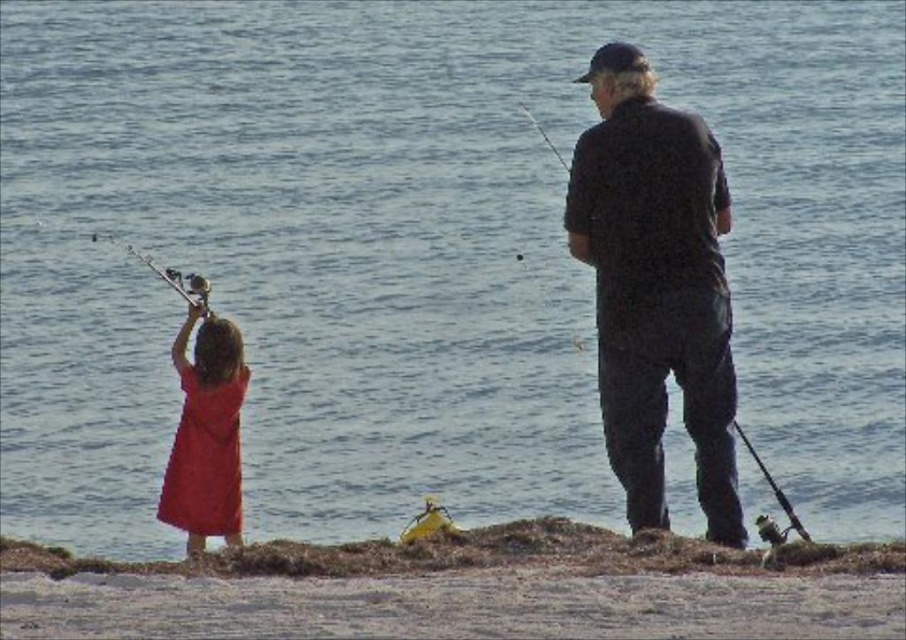
You are a drone operator who needs to capture a closeup shot of both the dark gray cotton shirt at right and the matte red dress at left. Given that your drone can only focus on objects within a 5 meter range, will you be able to capture both subjects in a single shot?

The distance between the dark gray cotton shirt at right and the matte red dress at left is 5.31 meters, which exceeds the drone camera focus range of 5 meters. Therefore, you cannot capture both subjects in a single shot.

You are a photographer trying to capture a candid shot of the two people fishing. You want to ensure that the brown seaweed at lower center and the dark gray cotton shirt at right are both in the frame. Based on their positions, which object is closer to the left edge of your camera viewfinder?

The brown seaweed at lower center is closer to the left edge of the camera viewfinder because it is positioned to the left of the dark gray cotton shirt at right.